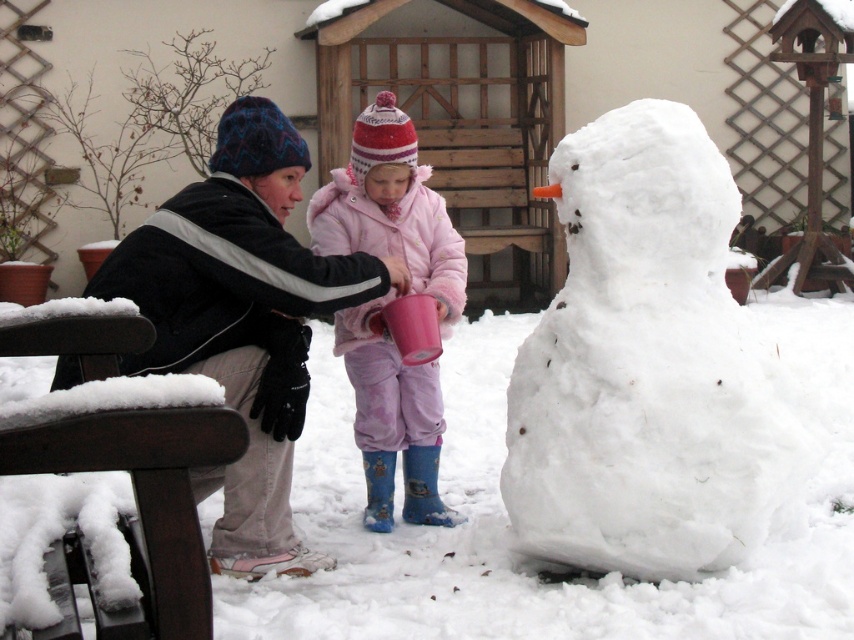
Based on the photo, you are standing at the center of the snowy backyard. The wooden shed is behind you. Where is the white fluffy snowman at right located relative to you?

The white fluffy snowman at right is located to your right side, at coordinates approximately 0.573 on the x axis and 0.758 on the y axis.

You are standing in the snowy backyard and want to build a snowman. Where is the best place to start? Please provide coordinates in the format of a point like point (646,365).

The best place to start is at point (646,365) where the white fluffy snowman at right is located.

You are standing at the camera position and want to pick up the black fleece jacket at left. Is the jacket within a 4 meter reach from your current position?

The black fleece jacket at left and camera are 4.15 meters apart, so the jacket is slightly out of reach within 4 meters. You need to move closer.